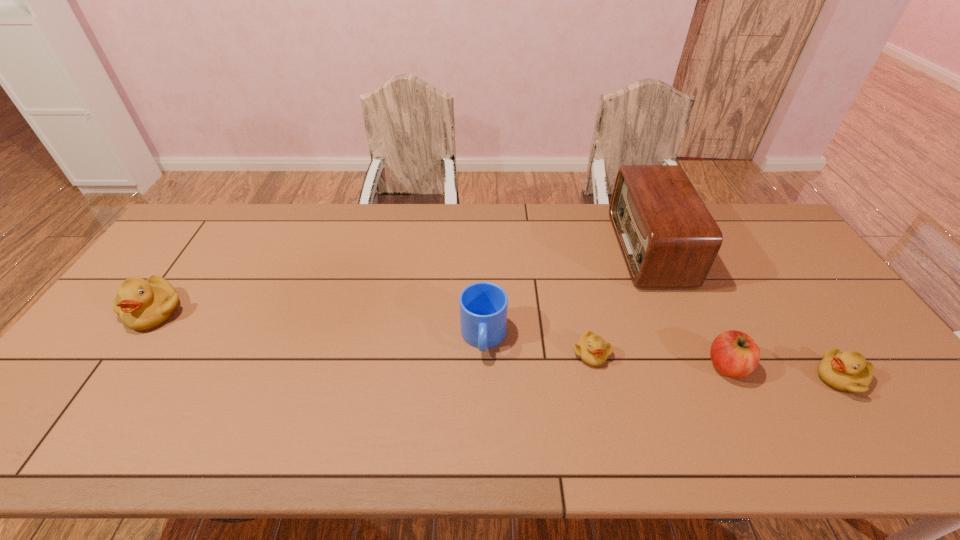
Locate an element on the screen. apple that is at the near edge is located at coordinates (733, 353).

At what (x,y) coordinates should I click in order to perform the action: click on object located at the left edge. Please return your answer as a coordinate pair (x, y). The height and width of the screenshot is (540, 960). Looking at the image, I should click on (142, 304).

At what (x,y) coordinates should I click in order to perform the action: click on object at the right edge. Please return your answer as a coordinate pair (x, y). Looking at the image, I should click on (848, 371).

Locate an element on the screen. Image resolution: width=960 pixels, height=540 pixels. object at the near right corner is located at coordinates (848, 371).

Where is `vacant space at the far edge`? vacant space at the far edge is located at coordinates (279, 214).

Image resolution: width=960 pixels, height=540 pixels. Find the location of `vacant space at the near edge of the desktop`. vacant space at the near edge of the desktop is located at coordinates (527, 382).

What are the coordinates of `vacant space at the left edge of the desktop` in the screenshot? It's located at (183, 293).

This screenshot has height=540, width=960. I want to click on vacant area at the far left corner, so click(205, 212).

Identify the location of free space at the near left corner. This screenshot has width=960, height=540. (93, 393).

Locate an element on the screen. This screenshot has height=540, width=960. free spot between the apple and the shortest duckling is located at coordinates (659, 360).